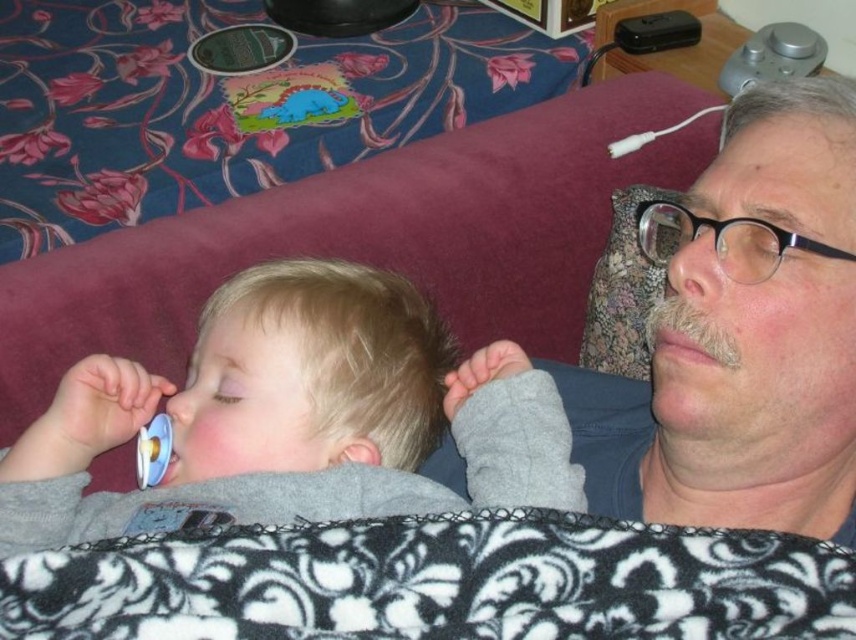
You are a nurse checking on a baby in a hospital room. You see the gray fleece baby at center and the white plastic pacifier at lower left. Is the pacifier within the baby s immediate reach?

The gray fleece baby at center is positioned over white plastic pacifier at lower left, so the pacifier is under the baby and may not be easily accessible for the baby to reach.

You are a photographer trying to capture a closeup of the gray fleece baby at center and the matte gray shirt at upper right in the scene. Since the camera can only focus on objects within a 10 cm height difference, will both objects be in focus?

The gray fleece baby at center is shorter than the matte gray shirt at upper right, but the exact height difference isn not provided. Without knowing if the difference is within 10 cm, it is impossible to determine if both will be in focus.